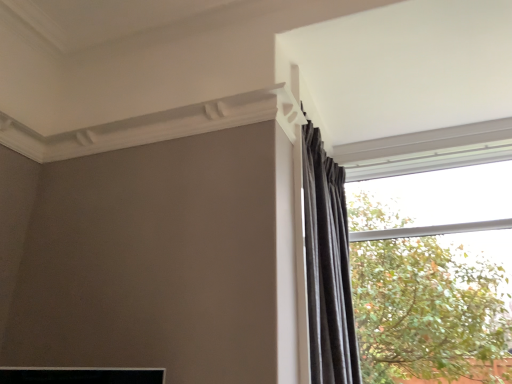
I want to click on transparent glass window at upper right, so click(x=432, y=253).

What is the approximate height of transparent glass window at upper right?

transparent glass window at upper right is 4.79 feet in height.

Measure the distance between point (395, 328) and camera.

Point (395, 328) is 15.97 feet from camera.

What do you see at coordinates (432, 253) in the screenshot? I see `transparent glass window at upper right` at bounding box center [432, 253].

In order to face transparent glass window at upper right, should I rotate leftwards or rightwards?

You should look right and rotate roughly 23.283 degrees.

Find the location of a particular element. This screenshot has height=384, width=512. black velvet curtain at upper right is located at coordinates (327, 266).

What do you see at coordinates (327, 266) in the screenshot?
I see `black velvet curtain at upper right` at bounding box center [327, 266].

This screenshot has height=384, width=512. Identify the location of transparent glass window at upper right. (432, 253).

Based on their positions, is black velvet curtain at upper right located to the left or right of transparent glass window at upper right?

In the image, black velvet curtain at upper right appears on the left side of transparent glass window at upper right.

Is the depth of black velvet curtain at upper right greater than that of transparent glass window at upper right?

No, black velvet curtain at upper right is closer to the viewer.

Is point (353, 325) behind point (411, 202)?

That is False.

From the image's perspective, does black velvet curtain at upper right appear lower than transparent glass window at upper right?

Incorrect, from the image's perspective, black velvet curtain at upper right is higher than transparent glass window at upper right.

From a real-world perspective, is black velvet curtain at upper right physically located above or below transparent glass window at upper right?

black velvet curtain at upper right is above transparent glass window at upper right.

Which object is thinner, black velvet curtain at upper right or transparent glass window at upper right?

transparent glass window at upper right is thinner.

Considering the sizes of objects black velvet curtain at upper right and transparent glass window at upper right in the image provided, who is taller, black velvet curtain at upper right or transparent glass window at upper right?

black velvet curtain at upper right.

Which of these two, black velvet curtain at upper right or transparent glass window at upper right, is smaller?

transparent glass window at upper right.

Is transparent glass window at upper right a part of black velvet curtain at upper right?

Actually, transparent glass window at upper right is outside black velvet curtain at upper right.

Would you say black velvet curtain at upper right is a long distance from transparent glass window at upper right?

black velvet curtain at upper right is far away from transparent glass window at upper right.

Does black velvet curtain at upper right turn towards transparent glass window at upper right?

No, black velvet curtain at upper right is not oriented towards transparent glass window at upper right.

Measure the distance from black velvet curtain at upper right to transparent glass window at upper right.

black velvet curtain at upper right and transparent glass window at upper right are 8.49 feet apart from each other.

There is a transparent glass window at upper right. Identify the location of curtain above it (from a real-world perspective). pos(327,266).

In the image, is transparent glass window at upper right on the left side or the right side of black velvet curtain at upper right?

transparent glass window at upper right is positioned on black velvet curtain at upper right's right side.

Is transparent glass window at upper right in front of black velvet curtain at upper right?

No, transparent glass window at upper right is further to the viewer.

Is point (457, 298) positioned in front of point (316, 255)?

No, it is not.

From the image's perspective, would you say transparent glass window at upper right is shown under black velvet curtain at upper right?

Yes, from the image's perspective, transparent glass window at upper right is beneath black velvet curtain at upper right.

From a real-world perspective, who is located lower, transparent glass window at upper right or black velvet curtain at upper right?

transparent glass window at upper right is physically lower.

In the scene shown: Considering the sizes of transparent glass window at upper right and black velvet curtain at upper right in the image, is transparent glass window at upper right wider or thinner than black velvet curtain at upper right?

Considering their sizes, transparent glass window at upper right looks slimmer than black velvet curtain at upper right.

Which of these two, transparent glass window at upper right or black velvet curtain at upper right, stands shorter?

With less height is transparent glass window at upper right.

Between transparent glass window at upper right and black velvet curtain at upper right, which one has larger size?

With larger size is black velvet curtain at upper right.

Based on the photo, is transparent glass window at upper right not inside black velvet curtain at upper right?

Yes.

Is the surface of transparent glass window at upper right in direct contact with black velvet curtain at upper right?

No, transparent glass window at upper right is not with black velvet curtain at upper right.

Is black velvet curtain at upper right at the back of transparent glass window at upper right?

That's not correct — transparent glass window at upper right is not looking away from black velvet curtain at upper right.

Based on the photo, how many degrees apart are the facing directions of transparent glass window at upper right and black velvet curtain at upper right?

The facing directions of transparent glass window at upper right and black velvet curtain at upper right are 89.2 degrees apart.

How much distance is there between transparent glass window at upper right and black velvet curtain at upper right?

transparent glass window at upper right and black velvet curtain at upper right are 8.49 feet apart.

Locate an element on the screen. The height and width of the screenshot is (384, 512). window located underneath the black velvet curtain at upper right (from a real-world perspective) is located at coordinates (432, 253).

Locate an element on the screen. This screenshot has height=384, width=512. curtain above the transparent glass window at upper right (from a real-world perspective) is located at coordinates (327, 266).

Where is `curtain in front of the transparent glass window at upper right`? This screenshot has width=512, height=384. curtain in front of the transparent glass window at upper right is located at coordinates (327, 266).